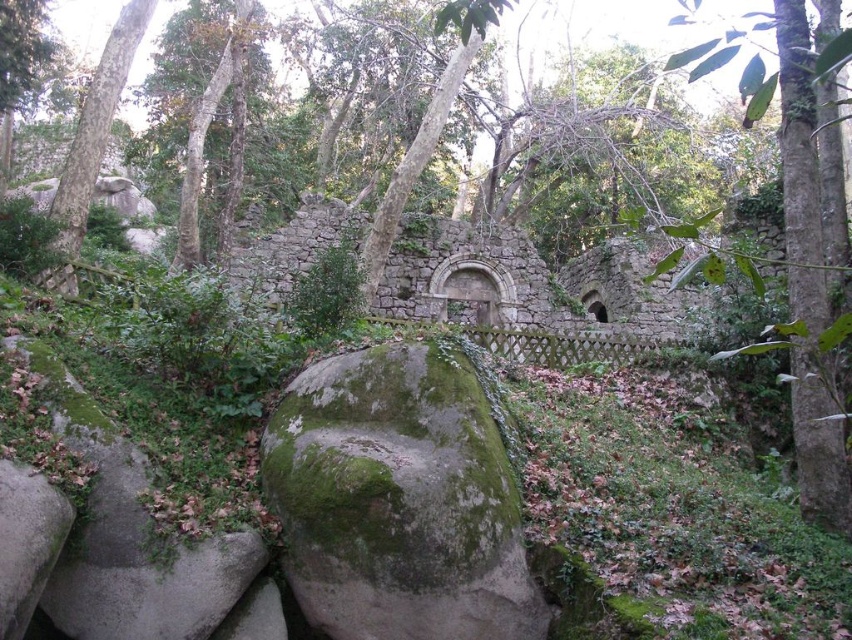
Consider the image. You are a hiker who wants to cross the area between the green mossy rock at center and the green mossy rock at left. Since you need to step on the rocks to avoid the muddy ground, which rock should you step on first?

You should step on the green mossy rock at left first because it is above the green mossy rock at center, so it is closer to you.

You are an explorer in the forest and need to cross over the green mossy rock at center and the green mossy rock at left. Which rock should you step on first to avoid the larger one?

You should step on the green mossy rock at center first because it is smaller compared to the green mossy rock at left, so the larger rock is the one at left.